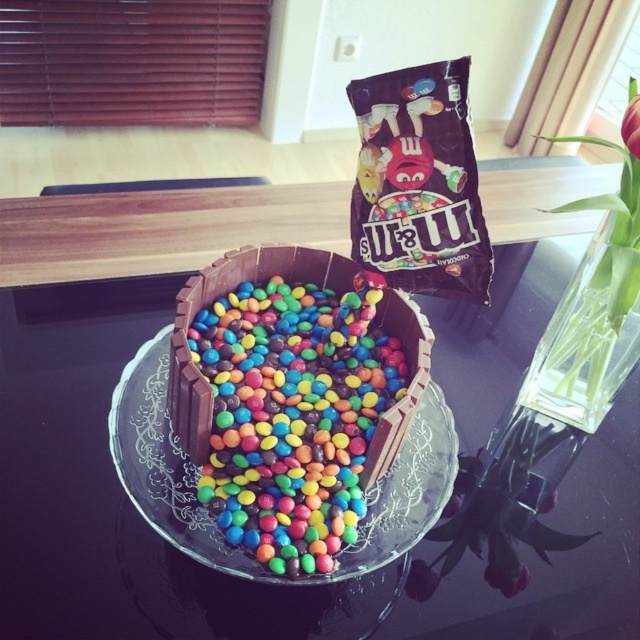
Does transparent glass table at center appear on the right side of transparent glass plate at center?

Yes, transparent glass table at center is to the right of transparent glass plate at center.

Which is in front, point (609, 588) or point (400, 540)?

Point (400, 540)

Identify the location of transparent glass table at center. This screenshot has height=640, width=640. (115, 492).